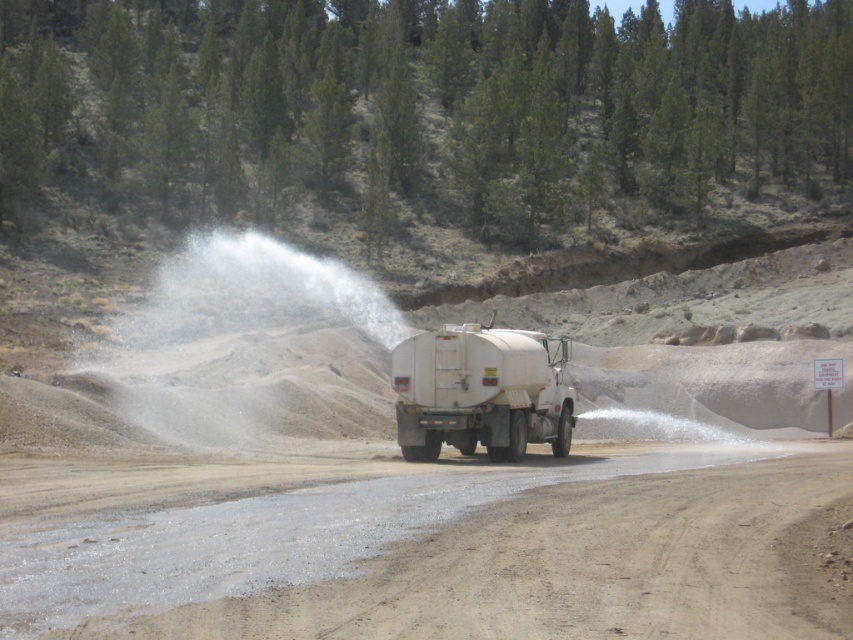
Question: Can you confirm if white powdery dust at center is positioned above white matte tanker truck at center?

Choices:
 (A) yes
 (B) no

Answer: (A)

Question: Does green textured pine forest at upper center have a larger size compared to dull brown dirt track at center?

Choices:
 (A) yes
 (B) no

Answer: (A)

Question: Is dull brown dirt track at center behind white powdery dust at center?

Choices:
 (A) no
 (B) yes

Answer: (A)

Question: Based on their relative distances, which object is nearer to the white powdery dust at center?

Choices:
 (A) white matte tanker truck at center
 (B) green textured pine forest at upper center
 (C) dull brown dirt track at center

Answer: (A)

Question: Which of these objects is positioned closest to the green textured pine forest at upper center?

Choices:
 (A) white powdery dust at center
 (B) dull brown dirt track at center
 (C) white matte tanker truck at center

Answer: (A)

Question: Considering the real-world distances, which object is closest to the white matte tanker truck at center?

Choices:
 (A) white powdery dust at center
 (B) dull brown dirt track at center
 (C) green textured pine forest at upper center

Answer: (B)